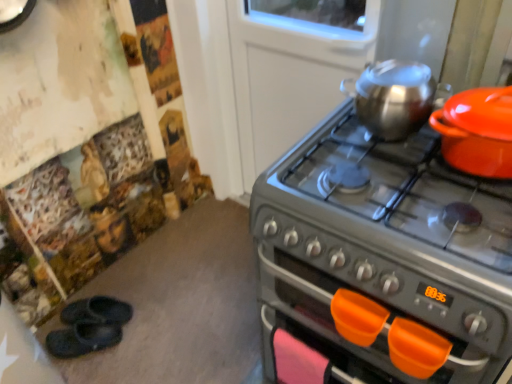
Question: Does shiny metallic kettle at upper right, positioned as the second kitchen appliance in right-to-left order, have a smaller size compared to black rubber slippers at lower left, the second footwear in the back-to-front sequence?

Choices:
 (A) yes
 (B) no

Answer: (B)

Question: Can you confirm if shiny metallic kettle at upper right, positioned as the second kitchen appliance in right-to-left order, is shorter than black rubber slippers at lower left, the second footwear in the back-to-front sequence?

Choices:
 (A) yes
 (B) no

Answer: (B)

Question: Does shiny metallic kettle at upper right, positioned as the second kitchen appliance in right-to-left order, turn towards black rubber slippers at lower left, the second footwear in the back-to-front sequence?

Choices:
 (A) yes
 (B) no

Answer: (B)

Question: Can you confirm if shiny metallic kettle at upper right, positioned as the second kitchen appliance in right-to-left order, is taller than black rubber slippers at lower left, the second footwear in the back-to-front sequence?

Choices:
 (A) yes
 (B) no

Answer: (A)

Question: Is shiny metallic kettle at upper right, the 1th kitchen appliance in the left-to-right sequence, positioned behind black rubber slippers at lower left, the second footwear in the back-to-front sequence?

Choices:
 (A) yes
 (B) no

Answer: (B)

Question: Would you say black rubber slippers at lower left, marked as the 1th footwear in a front-to-back arrangement, is to the left or to the right of orange plastic handle at lower center in the picture?

Choices:
 (A) left
 (B) right

Answer: (A)

Question: Considering the positions of point (73, 342) and point (384, 324), is point (73, 342) closer or farther from the camera than point (384, 324)?

Choices:
 (A) closer
 (B) farther

Answer: (B)

Question: Considering the positions of black rubber slippers at lower left, the second footwear in the back-to-front sequence, and orange plastic handle at lower center in the image, is black rubber slippers at lower left, the second footwear in the back-to-front sequence, taller or shorter than orange plastic handle at lower center?

Choices:
 (A) tall
 (B) short

Answer: (B)

Question: Is black rubber slippers at lower left, the second footwear in the back-to-front sequence, wider or thinner than orange plastic handle at lower center?

Choices:
 (A) wide
 (B) thin

Answer: (A)

Question: Considering the positions of point (289, 256) and point (93, 317), is point (289, 256) closer or farther from the camera than point (93, 317)?

Choices:
 (A) farther
 (B) closer

Answer: (B)

Question: In the image, is metallic gray gas stove at right on the left side or the right side of black rubber slippers at lower left, which appears as the 2th footwear when viewed from the front?

Choices:
 (A) left
 (B) right

Answer: (B)

Question: Based on their sizes in the image, would you say metallic gray gas stove at right is bigger or smaller than black rubber slippers at lower left, which is the 1th footwear from back to front?

Choices:
 (A) big
 (B) small

Answer: (A)

Question: Choose the correct answer: Is metallic gray gas stove at right inside black rubber slippers at lower left, which is the 1th footwear from back to front, or outside it?

Choices:
 (A) inside
 (B) outside

Answer: (B)

Question: From a real-world perspective, is orange plastic handle at lower center above or below black rubber slippers at lower left, which is the 1th footwear from back to front?

Choices:
 (A) above
 (B) below

Answer: (A)

Question: Is orange plastic handle at lower center bigger or smaller than black rubber slippers at lower left, which is the 1th footwear from back to front?

Choices:
 (A) big
 (B) small

Answer: (B)